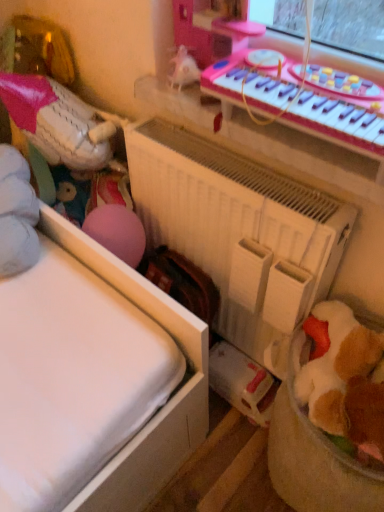
Locate an element on the screen. The image size is (384, 512). pink plastic musical keyboard at upper right is located at coordinates (302, 100).

What do you see at coordinates (334, 362) in the screenshot?
I see `soft brown plush toy at lower right, which is the 1th toy in right-to-left order` at bounding box center [334, 362].

I want to click on white matte radiator at center, so click(x=234, y=221).

You are a GUI agent. You are given a task and a screenshot of the screen. Output one action in this format:
    pyautogui.click(x=<x>, y=<y>)
    Task: Click on the pink plastic musical keyboard at upper right
    The image size is (384, 512).
    Given the screenshot: What is the action you would take?
    pyautogui.click(x=302, y=100)

What's the angular difference between white matte baseball glove at left, positioned as the second toy in right-to-left order, and soft brown plush toy at lower right, positioned as the 2th toy in back-to-front order,'s facing directions?

There is a 91.2-degree angle between the facing directions of white matte baseball glove at left, positioned as the second toy in right-to-left order, and soft brown plush toy at lower right, positioned as the 2th toy in back-to-front order.

Could you tell me if white matte baseball glove at left, the first toy viewed from the left, is turned towards soft brown plush toy at lower right, placed as the 1th toy when sorted from front to back?

Yes, white matte baseball glove at left, the first toy viewed from the left, is facing soft brown plush toy at lower right, placed as the 1th toy when sorted from front to back.

From the image's perspective, which one is positioned lower, white matte baseball glove at left, the 1th toy positioned from the top, or soft brown plush toy at lower right, marked as the second toy in a top-to-bottom arrangement?

From the image's view, soft brown plush toy at lower right, marked as the second toy in a top-to-bottom arrangement, is below.

Image resolution: width=384 pixels, height=512 pixels. Identify the location of toy on the right of white matte baseball glove at left, arranged as the second toy when viewed from the front. (334, 362).

Would you say white matte radiator at center is part of white matte baseball glove at left, arranged as the second toy when viewed from the front,'s contents?

Definitely not — white matte radiator at center is not inside white matte baseball glove at left, arranged as the second toy when viewed from the front.

Between white matte baseball glove at left, arranged as the second toy when viewed from the front, and white matte radiator at center, which one has smaller width?

With smaller width is white matte radiator at center.

From a real-world perspective, is white matte baseball glove at left, the 1th toy positioned from the top, below white matte radiator at center?

Actually, white matte baseball glove at left, the 1th toy positioned from the top, is physically above white matte radiator at center in the real world.

How different are the orientations of white matte baseball glove at left, which is the first toy from back to front, and white matte radiator at center in degrees?

white matte baseball glove at left, which is the first toy from back to front, and white matte radiator at center are facing 90 degrees away from each other.

Choose the correct answer: Is white matte radiator at center inside white matte baseball glove at left, the first toy viewed from the left, or outside it?

white matte radiator at center lies outside white matte baseball glove at left, the first toy viewed from the left.

From the image's perspective, is white matte radiator at center below white matte baseball glove at left, which is the first toy from back to front?

Correct, white matte radiator at center appears lower than white matte baseball glove at left, which is the first toy from back to front, in the image.

Does white matte radiator at center have a lesser width compared to white matte baseball glove at left, the 2th toy positioned from the bottom?

Yes.

Based on their sizes in the image, would you say white matte radiator at center is bigger or smaller than white matte baseball glove at left, arranged as the second toy when viewed from the front?

In the image, white matte radiator at center appears to be larger than white matte baseball glove at left, arranged as the second toy when viewed from the front.

Is there a large distance between soft brown plush toy at lower right, the first toy in the bottom-to-top sequence, and white matte baseball glove at left, the 1th toy positioned from the top?

They are positioned close to each other.

Is soft brown plush toy at lower right, placed as the 1th toy when sorted from front to back, surrounding white matte baseball glove at left, the 1th toy positioned from the top?

No, white matte baseball glove at left, the 1th toy positioned from the top, is not inside soft brown plush toy at lower right, placed as the 1th toy when sorted from front to back.

From the image's perspective, who appears lower, soft brown plush toy at lower right, the first toy in the bottom-to-top sequence, or white matte baseball glove at left, the 2th toy positioned from the bottom?

soft brown plush toy at lower right, the first toy in the bottom-to-top sequence, from the image's perspective.

Is soft brown plush toy at lower right, which is the 1th toy in right-to-left order, oriented away from white matte baseball glove at left, positioned as the second toy in right-to-left order?

No.

Which of these two, pink plastic musical keyboard at upper right or white matte baseball glove at left, positioned as the second toy in right-to-left order, is bigger?

white matte baseball glove at left, positioned as the second toy in right-to-left order, is bigger.

Where is `musical keyboard located above the white matte baseball glove at left, which is the first toy from back to front (from a real-world perspective)`? The width and height of the screenshot is (384, 512). musical keyboard located above the white matte baseball glove at left, which is the first toy from back to front (from a real-world perspective) is located at coordinates (302, 100).

Is pink plastic musical keyboard at upper right oriented towards white matte baseball glove at left, the first toy viewed from the left?

No, pink plastic musical keyboard at upper right is not turned towards white matte baseball glove at left, the first toy viewed from the left.

Considering the relative positions of pink plastic musical keyboard at upper right and soft brown plush toy at lower right, placed as the 1th toy when sorted from front to back, in the image provided, is pink plastic musical keyboard at upper right to the right of soft brown plush toy at lower right, placed as the 1th toy when sorted from front to back, from the viewer's perspective?

Incorrect, pink plastic musical keyboard at upper right is not on the right side of soft brown plush toy at lower right, placed as the 1th toy when sorted from front to back.

How different are the orientations of pink plastic musical keyboard at upper right and soft brown plush toy at lower right, the first toy in the bottom-to-top sequence, in degrees?

The angular difference between pink plastic musical keyboard at upper right and soft brown plush toy at lower right, the first toy in the bottom-to-top sequence, is 179 degrees.

Is pink plastic musical keyboard at upper right further to the viewer compared to soft brown plush toy at lower right, placed as the 1th toy when sorted from front to back?

Yes, pink plastic musical keyboard at upper right is behind soft brown plush toy at lower right, placed as the 1th toy when sorted from front to back.

Considering the positions of point (252, 90) and point (364, 346), is point (252, 90) closer or farther from the camera than point (364, 346)?

Point (252, 90) appears to be closer to the viewer than point (364, 346).

Considering the relative sizes of soft brown plush toy at lower right, which is the 1th toy in right-to-left order, and pink plastic musical keyboard at upper right in the image provided, is soft brown plush toy at lower right, which is the 1th toy in right-to-left order, wider than pink plastic musical keyboard at upper right?

Incorrect, the width of soft brown plush toy at lower right, which is the 1th toy in right-to-left order, does not surpass that of pink plastic musical keyboard at upper right.

Would you say soft brown plush toy at lower right, positioned as the 2th toy in back-to-front order, is inside or outside pink plastic musical keyboard at upper right?

soft brown plush toy at lower right, positioned as the 2th toy in back-to-front order, is located beyond the bounds of pink plastic musical keyboard at upper right.

From the image's perspective, is soft brown plush toy at lower right, the first toy in the bottom-to-top sequence, located above pink plastic musical keyboard at upper right?

No, from the image's perspective, soft brown plush toy at lower right, the first toy in the bottom-to-top sequence, is not over pink plastic musical keyboard at upper right.

Identify the location of toy on the right of white matte baseball glove at left, the 2th toy positioned from the bottom. click(334, 362).

This screenshot has height=512, width=384. Identify the location of radiator below the white matte baseball glove at left, the 1th toy positioned from the top (from a real-world perspective). (234, 221).

Which object lies nearer to the anchor point white matte baseball glove at left, arranged as the second toy when viewed from the front, white matte radiator at center or soft brown plush toy at lower right, marked as the second toy in a top-to-bottom arrangement?

The object closer to white matte baseball glove at left, arranged as the second toy when viewed from the front, is white matte radiator at center.

Looking at the image, which one is located closer to white matte baseball glove at left, the first toy viewed from the left, soft brown plush toy at lower right, which is the 1th toy in right-to-left order, or pink plastic musical keyboard at upper right?

pink plastic musical keyboard at upper right lies closer to white matte baseball glove at left, the first toy viewed from the left, than the other object.

Looking at this image, based on their spatial positions, is soft brown plush toy at lower right, marked as the second toy in a top-to-bottom arrangement, or white matte baseball glove at left, the 2th toy positioned from the bottom, closer to pink plastic musical keyboard at upper right?

soft brown plush toy at lower right, marked as the second toy in a top-to-bottom arrangement, is positioned closer to the anchor pink plastic musical keyboard at upper right.

Based on their spatial positions, is pink plastic musical keyboard at upper right or white matte radiator at center further from soft brown plush toy at lower right, the second toy positioned from the left?

The object further to soft brown plush toy at lower right, the second toy positioned from the left, is pink plastic musical keyboard at upper right.

Based on their spatial positions, is white matte radiator at center or pink plastic musical keyboard at upper right further from white matte baseball glove at left, positioned as the second toy in right-to-left order?

Based on the image, pink plastic musical keyboard at upper right appears to be further to white matte baseball glove at left, positioned as the second toy in right-to-left order.

Looking at the image, which one is located closer to pink plastic musical keyboard at upper right, white matte baseball glove at left, which is the first toy from back to front, or soft brown plush toy at lower right, marked as the second toy in a top-to-bottom arrangement?

soft brown plush toy at lower right, marked as the second toy in a top-to-bottom arrangement, is positioned closer to the anchor pink plastic musical keyboard at upper right.

Considering their positions, is white matte baseball glove at left, the first toy viewed from the left, positioned further to soft brown plush toy at lower right, placed as the 1th toy when sorted from front to back, than white matte radiator at center?

white matte baseball glove at left, the first toy viewed from the left, is further to soft brown plush toy at lower right, placed as the 1th toy when sorted from front to back.

Which object lies further to the anchor point white matte radiator at center, white matte baseball glove at left, positioned as the second toy in right-to-left order, or pink plastic musical keyboard at upper right?

white matte baseball glove at left, positioned as the second toy in right-to-left order, is positioned further to the anchor white matte radiator at center.

This screenshot has height=512, width=384. In order to click on radiator located between white matte baseball glove at left, which is the first toy from back to front, and pink plastic musical keyboard at upper right in the left-right direction in this screenshot , I will do `click(234, 221)`.

Where is `radiator between white matte baseball glove at left, positioned as the second toy in right-to-left order, and soft brown plush toy at lower right, placed as the 1th toy when sorted from front to back, in the horizontal direction`? The image size is (384, 512). radiator between white matte baseball glove at left, positioned as the second toy in right-to-left order, and soft brown plush toy at lower right, placed as the 1th toy when sorted from front to back, in the horizontal direction is located at coordinates (234, 221).

Identify the location of musical keyboard located between white matte baseball glove at left, the 1th toy positioned from the top, and soft brown plush toy at lower right, the first toy in the bottom-to-top sequence, in the left-right direction. (302, 100).

This screenshot has width=384, height=512. In order to click on radiator between pink plastic musical keyboard at upper right and soft brown plush toy at lower right, positioned as the 2th toy in back-to-front order, in the vertical direction in this screenshot , I will do `click(234, 221)`.